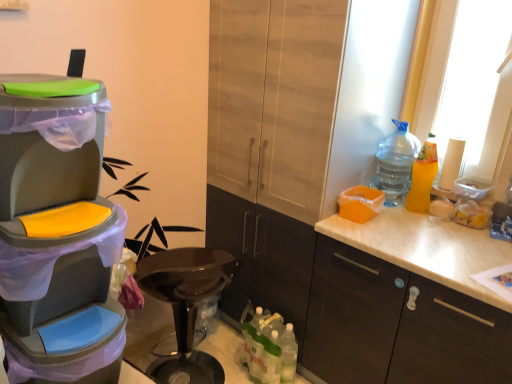
Question: Considering the positions of matte wood cabinet at center, which is the 2th cabinetry in right-to-left order, and yellow matte bottle at right, which is counted as the second bottle, starting from the top, in the image, is matte wood cabinet at center, which is the 2th cabinetry in right-to-left order, taller or shorter than yellow matte bottle at right, which is counted as the second bottle, starting from the top,?

Choices:
 (A) short
 (B) tall

Answer: (B)

Question: Is matte wood cabinet at center, which is the 2th cabinetry in right-to-left order, to the left or to the right of yellow matte bottle at right, which is the 1th bottle in right-to-left order, in the image?

Choices:
 (A) right
 (B) left

Answer: (B)

Question: Which object is positioned farthest from the clear plastic bottle at upper right, positioned as the 2th bottle in right-to-left order?

Choices:
 (A) matte wood cabinet at center, which is the 1th cabinetry in left-to-right order
 (B) yellow matte bottle at right, which is the 1th bottle in right-to-left order
 (C) matte plastic trash can at left
 (D) white matte cabinet at right, arranged as the 1th cabinetry when viewed from the right
 (E) white paper towel at right

Answer: (C)

Question: Estimate the real-world distances between objects in this image. Which object is closer to the matte plastic trash can at left?

Choices:
 (A) translucent plastic bottles at lower center, the first bottle when ordered from left to right
 (B) white matte cabinet at right, arranged as the 1th cabinetry when viewed from the right
 (C) yellow matte bottle at right, the 2th bottle in the bottom-to-top sequence
 (D) white paper towel at right
 (E) clear plastic bottle at upper right, acting as the first bottle starting from the top

Answer: (A)